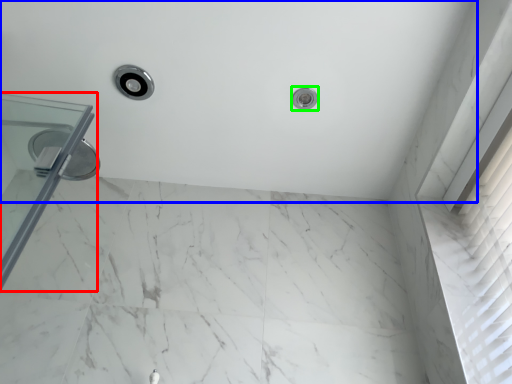
Question: Based on their relative distances, which object is farther from glass door (highlighted by a red box)? Choose from bath (highlighted by a blue box) and shower (highlighted by a green box).

Choices:
 (A) bath
 (B) shower

Answer: (B)